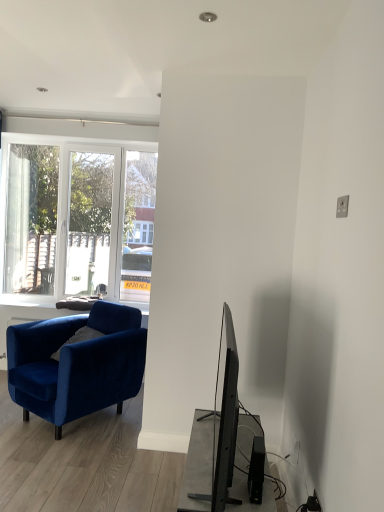
Locate an element on the screen. vacant space in front of velvet blue armchair at left is located at coordinates [x=57, y=460].